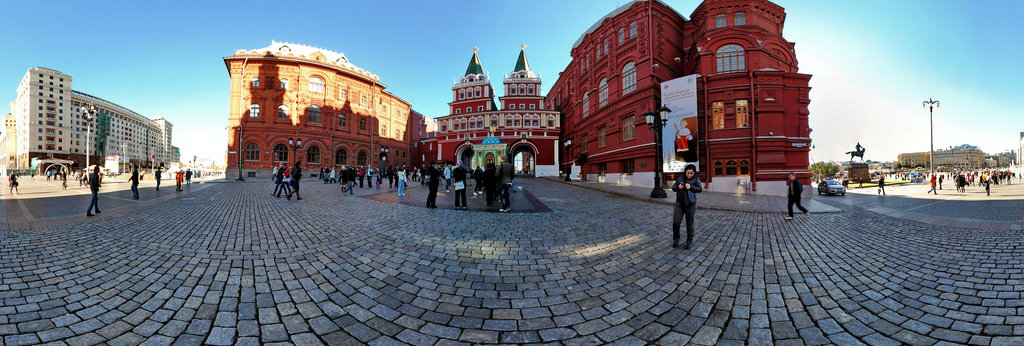
Find the location of a particular element. archway is located at coordinates (513, 160).